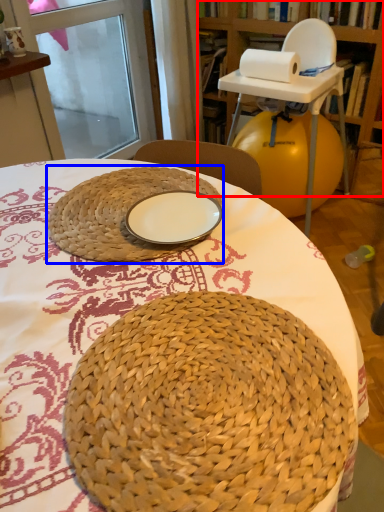
Question: Among these objects, which one is nearest to the camera, bookshelf (highlighted by a red box) or basket (highlighted by a blue box)?

Choices:
 (A) bookshelf
 (B) basket

Answer: (B)